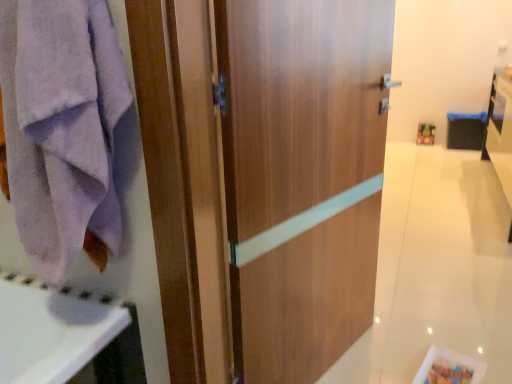
Question: Does wooden door at center have a greater height compared to lavender cotton towel at left?

Choices:
 (A) yes
 (B) no

Answer: (A)

Question: From a real-world perspective, is wooden door at center on top of lavender cotton towel at left?

Choices:
 (A) no
 (B) yes

Answer: (A)

Question: From the image's perspective, is wooden door at center above lavender cotton towel at left?

Choices:
 (A) yes
 (B) no

Answer: (B)

Question: Is lavender cotton towel at left completely or partially inside wooden door at center?

Choices:
 (A) yes
 (B) no

Answer: (B)

Question: Can we say wooden door at center lies outside lavender cotton towel at left?

Choices:
 (A) no
 (B) yes

Answer: (B)

Question: Is wooden door at center facing away from lavender cotton towel at left?

Choices:
 (A) yes
 (B) no

Answer: (B)

Question: Is white glossy vanity at right surrounded by lavender cotton towel at left?

Choices:
 (A) no
 (B) yes

Answer: (A)

Question: Does lavender cotton towel at left appear on the left side of white glossy vanity at right?

Choices:
 (A) no
 (B) yes

Answer: (B)

Question: Considering the relative sizes of lavender cotton towel at left and white glossy vanity at right in the image provided, is lavender cotton towel at left thinner than white glossy vanity at right?

Choices:
 (A) yes
 (B) no

Answer: (A)

Question: From the image's perspective, does lavender cotton towel at left appear higher than white glossy vanity at right?

Choices:
 (A) no
 (B) yes

Answer: (A)

Question: Would you say lavender cotton towel at left is a long distance from white glossy vanity at right?

Choices:
 (A) yes
 (B) no

Answer: (A)

Question: Considering the relative sizes of lavender cotton towel at left and white glossy vanity at right in the image provided, is lavender cotton towel at left smaller than white glossy vanity at right?

Choices:
 (A) yes
 (B) no

Answer: (A)

Question: Is white glossy vanity at right looking in the opposite direction of lavender cotton towel at left?

Choices:
 (A) yes
 (B) no

Answer: (B)